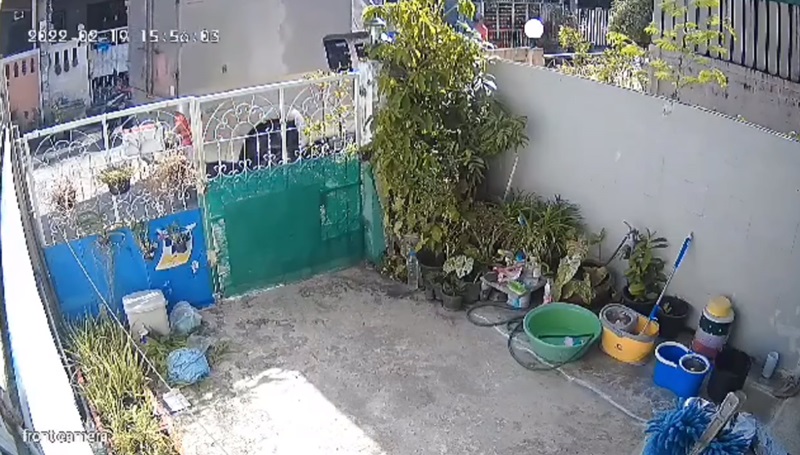
Locate an element on the screen. Image resolution: width=800 pixels, height=455 pixels. green bucket is located at coordinates (556, 318).